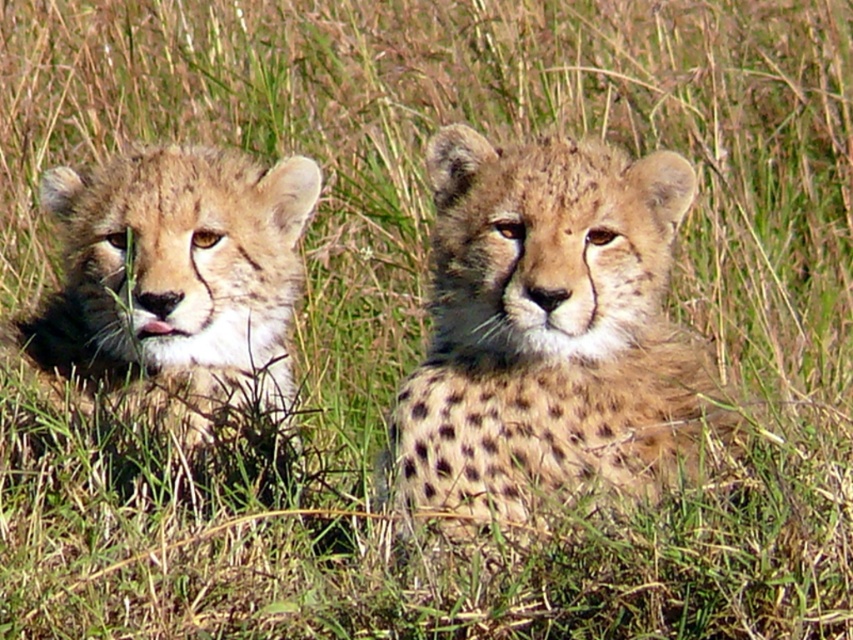
Who is more forward, [480,216] or [259,321]?

Point [480,216] is more forward.

The width and height of the screenshot is (853, 640). Identify the location of spotted fur cheetah at center. pos(547,330).